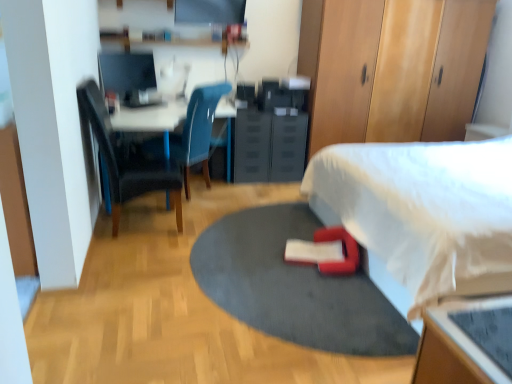
Image resolution: width=512 pixels, height=384 pixels. Find the location of `vacant space in front of red fabric bean bag chair at lower center`. vacant space in front of red fabric bean bag chair at lower center is located at coordinates point(335,297).